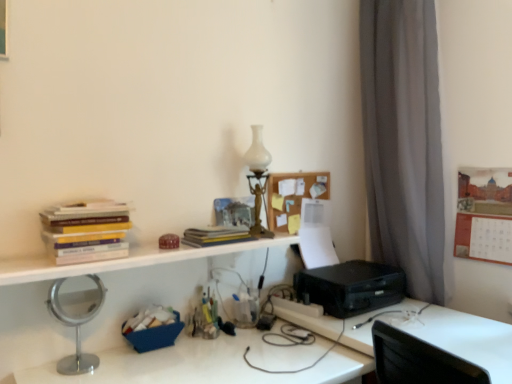
You are a GUI agent. You are given a task and a screenshot of the screen. Output one action in this format:
    pyautogui.click(x=<x>, y=<y>)
    Task: Click on the free space in front of matte brown box at center, which is the third stationery in bottom-to-top order
    The image size is (512, 384).
    Given the screenshot: What is the action you would take?
    pyautogui.click(x=147, y=255)